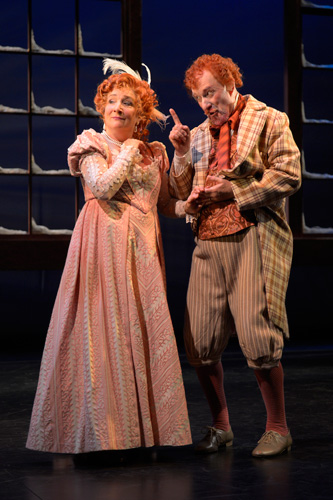
I want to click on stockings, so click(x=219, y=398), click(x=280, y=405).